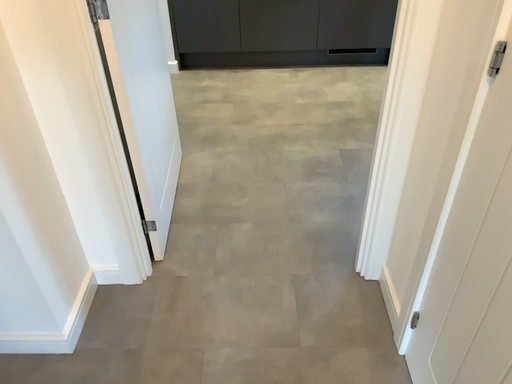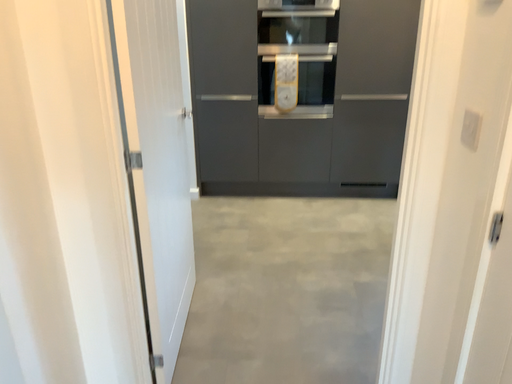
Question: Which way did the camera rotate in the video?

Choices:
 (A) rotated upward
 (B) rotated downward

Answer: (A)